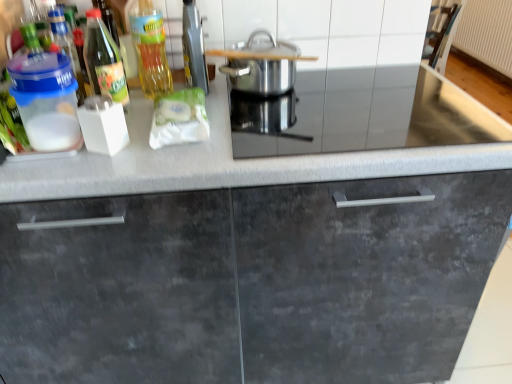
Question: Is metallic silver toaster at upper center in front of or behind matte gray cabinet at center in the image?

Choices:
 (A) behind
 (B) front

Answer: (A)

Question: Is metallic silver toaster at upper center bigger or smaller than matte gray cabinet at center?

Choices:
 (A) small
 (B) big

Answer: (A)

Question: Which object is the farthest from the translucent plastic container at upper left?

Choices:
 (A) matte gray cabinet at center
 (B) translucent glass bottle at upper left, the second bottle viewed from the left
 (C) white textured radiator at upper right
 (D) stainless steel pot at center
 (E) metallic silver toaster at upper center

Answer: (C)

Question: Considering the real-world distances, which object is closest to the transparent plastic container at left, the 1th bottle viewed from the left?

Choices:
 (A) translucent plastic container at upper left
 (B) white matte packet at center
 (C) matte gray cabinet at center
 (D) white textured radiator at upper right
 (E) metallic silver toaster at upper center

Answer: (A)